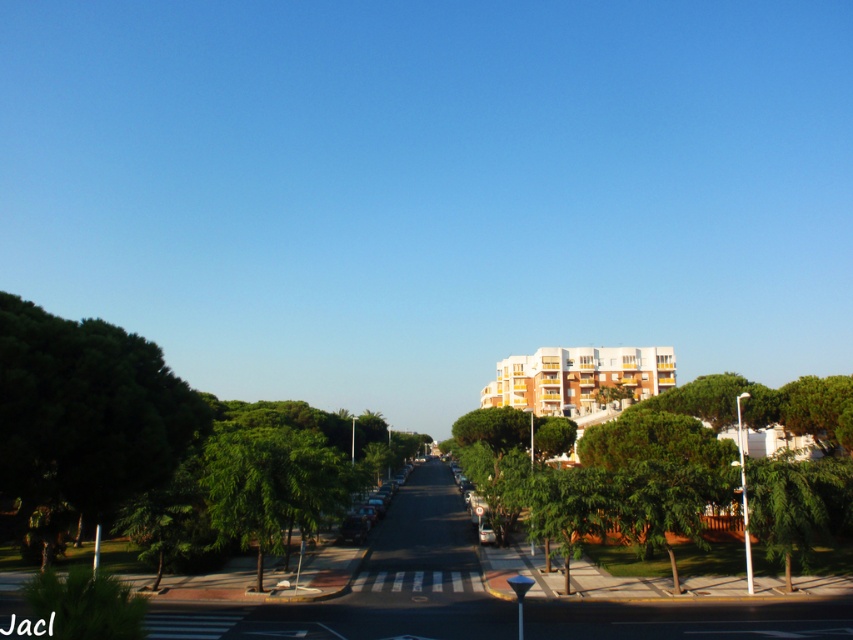
Who is positioned more to the right, green leafy tree at left or green leafy tree at center?

green leafy tree at center is more to the right.

Between green leafy tree at left and green leafy tree at center, which one is positioned lower?

green leafy tree at center

Which is in front, point (187, 397) or point (801, 432)?

Point (187, 397) is more forward.

I want to click on green leafy tree at left, so click(86, 410).

Does green leafy tree at left have a lesser width compared to metallic silver car at center-right?

No.

Is green leafy tree at left bigger than metallic silver car at center-right?

Correct, green leafy tree at left is larger in size than metallic silver car at center-right.

Is point (99, 435) closer to camera compared to point (486, 529)?

That is True.

At what (x,y) coordinates should I click in order to perform the action: click on green leafy tree at left. Please return your answer as a coordinate pair (x, y). Looking at the image, I should click on (86, 410).

Does green leafy tree at center appear on the right side of metallic silver car at center-right?

Yes, green leafy tree at center is to the right of metallic silver car at center-right.

Can you confirm if green leafy tree at center is taller than metallic silver car at center-right?

Yes, green leafy tree at center is taller than metallic silver car at center-right.

Is point (679, 410) behind point (485, 522)?

No.

You are a GUI agent. You are given a task and a screenshot of the screen. Output one action in this format:
    pyautogui.click(x=<x>, y=<y>)
    Task: Click on the green leafy tree at center
    This screenshot has height=640, width=853.
    Given the screenshot: What is the action you would take?
    pyautogui.click(x=769, y=406)